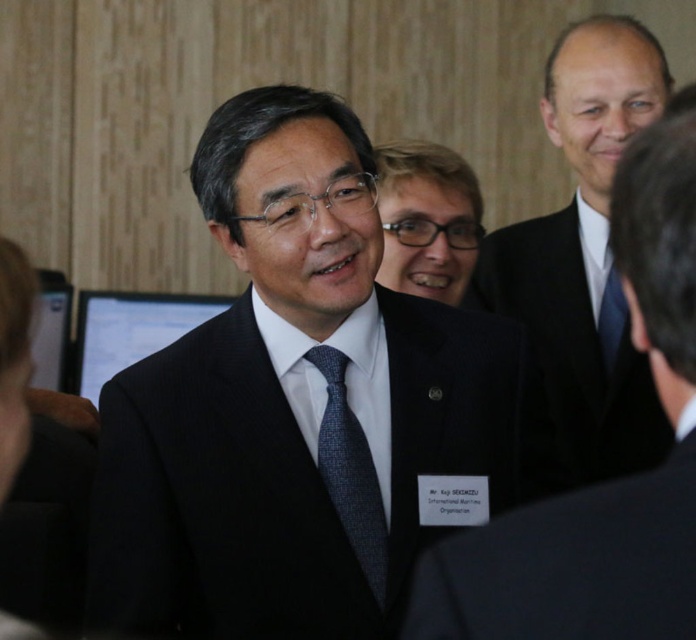
You are attending a formal event and need to choose between the satin black suit at center and the black matte suit at center based on their height. Which one should you pick if you want the taller option?

The satin black suit at center is much taller than the black matte suit at center, so you should pick the satin black suit at center for the taller option.

You are organizing a formal event and need to ensure the attire of the guests follows the dress code. You notice the satin black suit at upper right and the blue silk tie at right in the image. Which item is covering the other?

The satin black suit at upper right is positioned over the blue silk tie at right, so the suit is covering the tie.